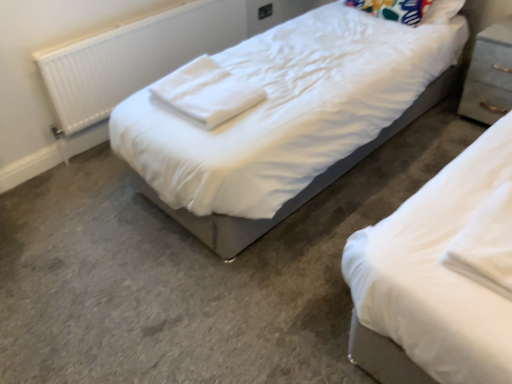
Question: Is white cotton cloth at center positioned with its back to light gray wood nightstand at right?

Choices:
 (A) no
 (B) yes

Answer: (B)

Question: Does white cotton cloth at center come behind light gray wood nightstand at right?

Choices:
 (A) no
 (B) yes

Answer: (A)

Question: Is white cotton cloth at center positioned far away from light gray wood nightstand at right?

Choices:
 (A) no
 (B) yes

Answer: (B)

Question: Is white cotton cloth at center positioned beyond the bounds of light gray wood nightstand at right?

Choices:
 (A) no
 (B) yes

Answer: (B)

Question: Is white cotton cloth at center oriented towards light gray wood nightstand at right?

Choices:
 (A) no
 (B) yes

Answer: (A)

Question: Is multicolored fabric pillow at upper right spatially inside light gray wood nightstand at right, or outside of it?

Choices:
 (A) inside
 (B) outside

Answer: (B)

Question: From their relative heights in the image, would you say multicolored fabric pillow at upper right is taller or shorter than light gray wood nightstand at right?

Choices:
 (A) tall
 (B) short

Answer: (B)

Question: From a real-world perspective, is multicolored fabric pillow at upper right positioned above or below light gray wood nightstand at right?

Choices:
 (A) below
 (B) above

Answer: (B)

Question: Based on their sizes in the image, would you say multicolored fabric pillow at upper right is bigger or smaller than light gray wood nightstand at right?

Choices:
 (A) big
 (B) small

Answer: (B)

Question: Do you think white plastic radiator at left is within light gray wood nightstand at right, or outside of it?

Choices:
 (A) outside
 (B) inside

Answer: (A)

Question: Relative to light gray wood nightstand at right, is white plastic radiator at left in front or behind?

Choices:
 (A) front
 (B) behind

Answer: (A)

Question: From a real-world perspective, is white plastic radiator at left positioned above or below light gray wood nightstand at right?

Choices:
 (A) above
 (B) below

Answer: (A)

Question: Looking at their shapes, would you say white plastic radiator at left is wider or thinner than light gray wood nightstand at right?

Choices:
 (A) wide
 (B) thin

Answer: (B)

Question: Is multicolored fabric pillow at upper right wider or thinner than white cotton cloth at center?

Choices:
 (A) wide
 (B) thin

Answer: (B)

Question: From their relative heights in the image, would you say multicolored fabric pillow at upper right is taller or shorter than white cotton cloth at center?

Choices:
 (A) tall
 (B) short

Answer: (A)